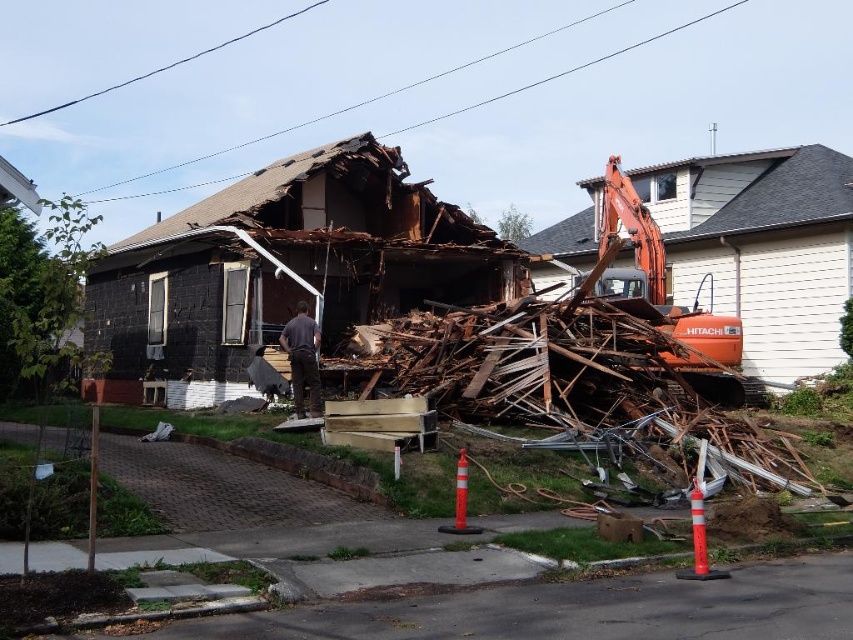
Question: Can you confirm if orange metallic excavator at center is positioned above dark gray fabric at center?

Choices:
 (A) yes
 (B) no

Answer: (A)

Question: Which point is farther from the camera taking this photo?

Choices:
 (A) (643, 264)
 (B) (291, 323)

Answer: (A)

Question: Is orange metallic excavator at center to the right of dark gray fabric at center from the viewer's perspective?

Choices:
 (A) yes
 (B) no

Answer: (A)

Question: Does orange metallic excavator at center appear on the right side of dark gray fabric at center?

Choices:
 (A) yes
 (B) no

Answer: (A)